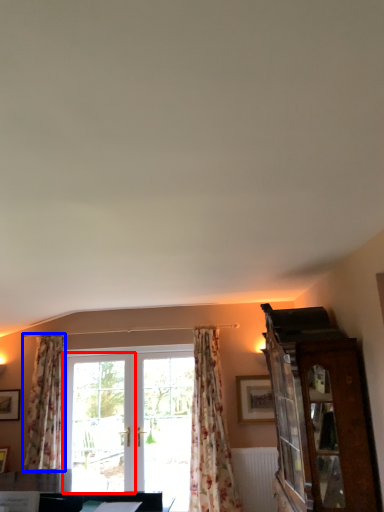
Question: Which of the following is the farthest to the observer, screen door (highlighted by a red box) or curtain (highlighted by a blue box)?

Choices:
 (A) screen door
 (B) curtain

Answer: (A)